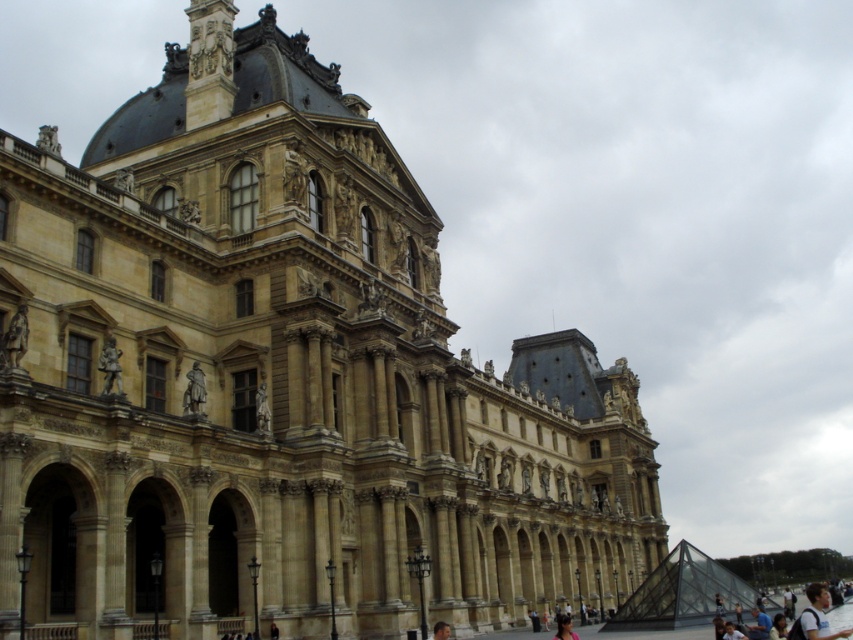
Question: Can you confirm if bronze statue at center is positioned above blurred fabric person at lower center?

Choices:
 (A) no
 (B) yes

Answer: (B)

Question: Can you confirm if light brown hair at lower right is bigger than blurred fabric person at lower center?

Choices:
 (A) no
 (B) yes

Answer: (B)

Question: Which object is positioned farthest from the bronze statue at center?

Choices:
 (A) dark brown hair at lower center
 (B) blurred fabric person at lower center
 (C) light brown hair at lower right

Answer: (C)

Question: Among these points, which one is nearest to the camera?

Choices:
 (A) (189, 380)
 (B) (820, 620)
 (C) (566, 636)
 (D) (437, 634)

Answer: (B)

Question: Which point is farther to the camera?

Choices:
 (A) (846, 628)
 (B) (573, 637)

Answer: (A)

Question: Does blurred fabric person at lower center appear on the right side of dark brown hair at lower center?

Choices:
 (A) yes
 (B) no

Answer: (A)